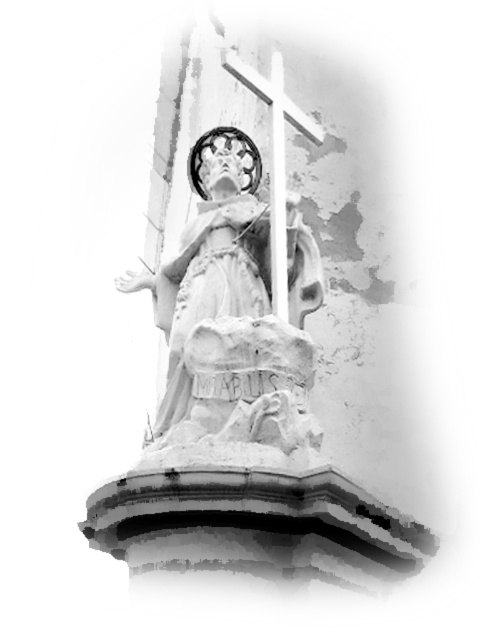
You are an art conservator examining the statue and its pedestal. You notice two points marked on the image at coordinates point (192,278) and point (316,129). Which point is nearer to you as you stand in front of the statue?

Point (192,278) is closer to the viewer than point (316,129).